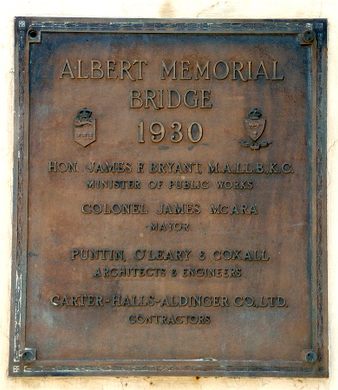
Identify the location of plaque. Image resolution: width=338 pixels, height=390 pixels. (293, 344).